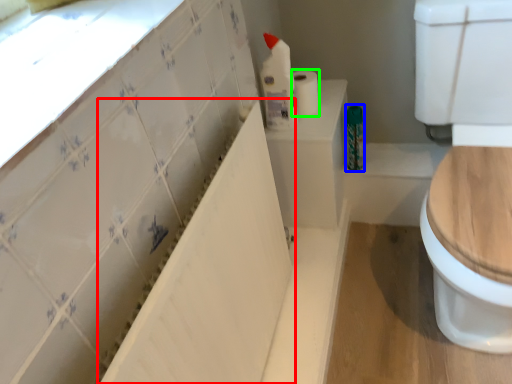
Question: Based on their relative distances, which object is nearer to bath (highlighted by a red box)? Choose from toiletry (highlighted by a blue box) and toilet paper (highlighted by a green box).

Choices:
 (A) toiletry
 (B) toilet paper

Answer: (B)